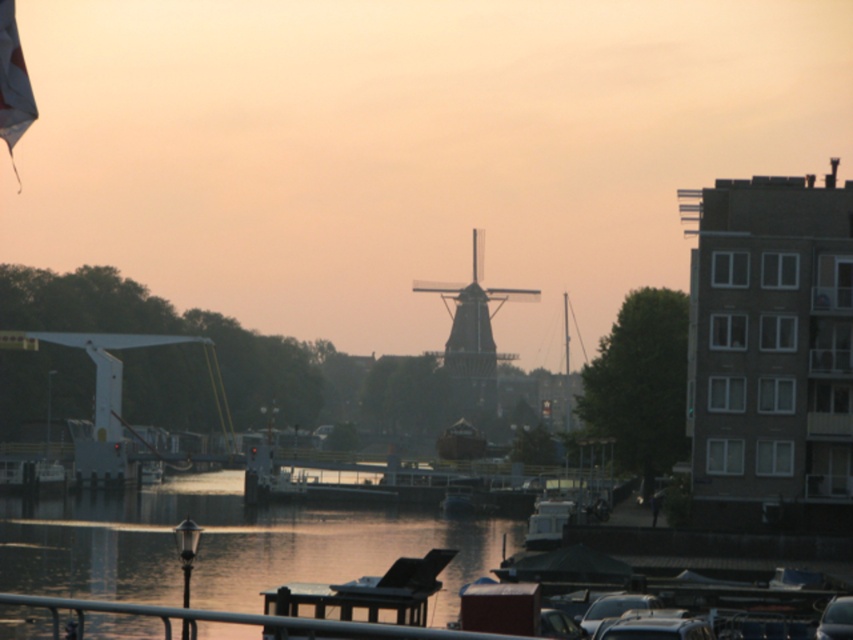
You are standing at the point labeled as point (223,545) in the image. What do you see directly in front of you?

You see silvery reflective water at center directly in front of you at point (223,545).

You are an architect designing a new riverside walkway and want to ensure that visitors can see both the silvery reflective water at center and the metallic gray rail at lower center. Based on their heights, which object will appear taller from a distance?

The silvery reflective water at center appears taller than the metallic gray rail at lower center because it has a greater height compared to the metallic gray rail at lower center.